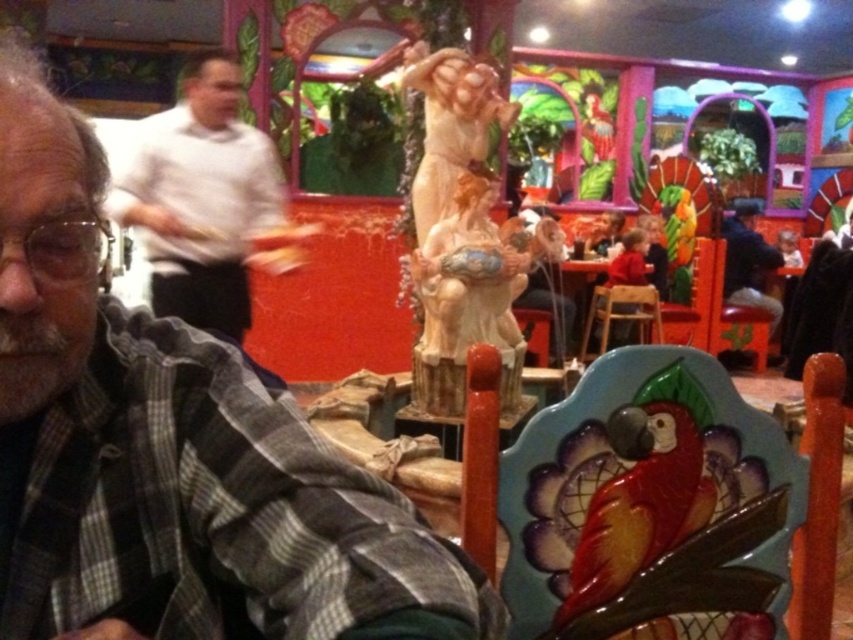
You are standing in the restaurant and want to take a photo of the statue. The statue is located at point (x=231, y=481). If your camera is 25.84 inches away from that point, is the statue within the camera frame?

Yes, the statue at point (x=231, y=481) is within the camera frame because the distance between them is exactly 25.84 inches, which is the specified distance provided.

You are a photographer trying to capture a clear shot of the plaid shirt at center without the white shirt at upper left blocking the view. Based on the scene description, is this possible?

Yes, the plaid shirt at center is in front of the white shirt at upper left, so you can capture a clear shot of the plaid shirt at center without obstruction from the white shirt at upper left.

You are standing at the entrance of the restaurant and see two points marked in the image. The first point is at coordinate point[33,362] and the second is at point[451,188]. Which point is closer to you?

Point[33,362] is in front of point[451,188], so it is closer to you.